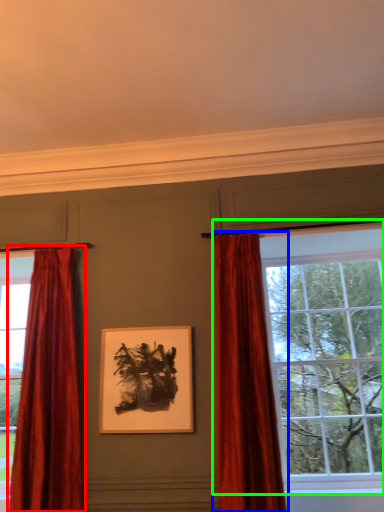
Question: Estimate the real-world distances between objects in this image. Which object is closer to curtain (highlighted by a red box), curtain (highlighted by a blue box) or window (highlighted by a green box)?

Choices:
 (A) curtain
 (B) window

Answer: (A)